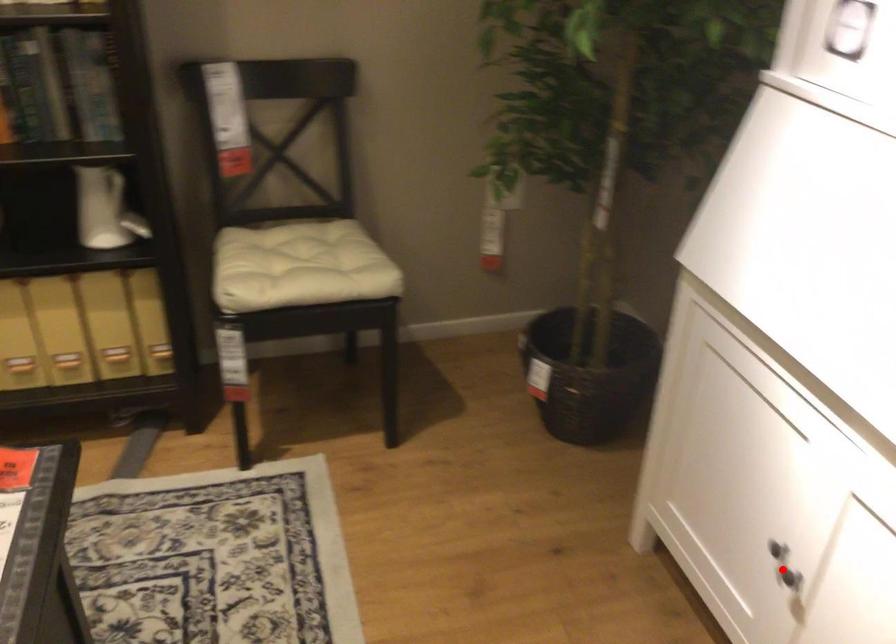
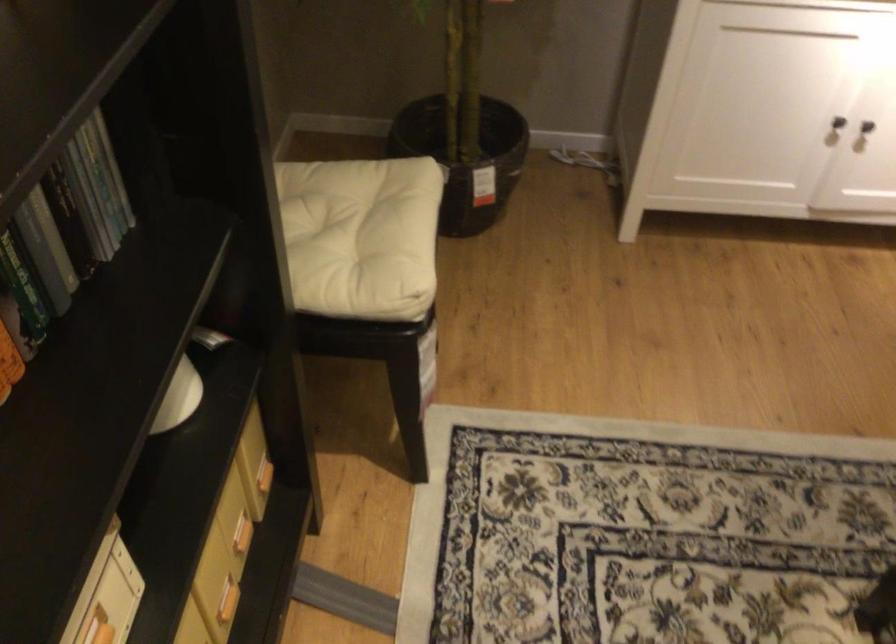
Where in the second image is the point corresponding to the highlighted location from the first image?

(866, 126)